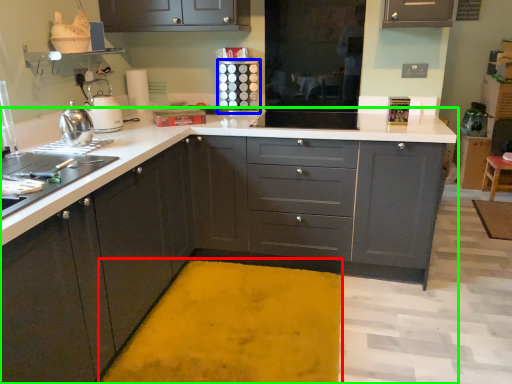
Question: Which is nearer to the bath mat (highlighted by a red box)? appliance (highlighted by a blue box) or countertop (highlighted by a green box).

Choices:
 (A) appliance
 (B) countertop

Answer: (B)